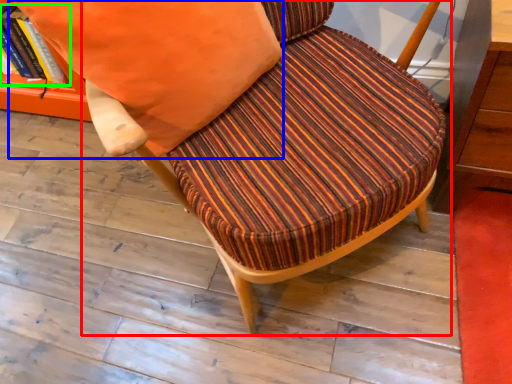
Question: Based on their relative distances, which object is nearer to chair (highlighted by a red box)? Choose from throw pillow (highlighted by a blue box) and book (highlighted by a green box).

Choices:
 (A) throw pillow
 (B) book

Answer: (A)